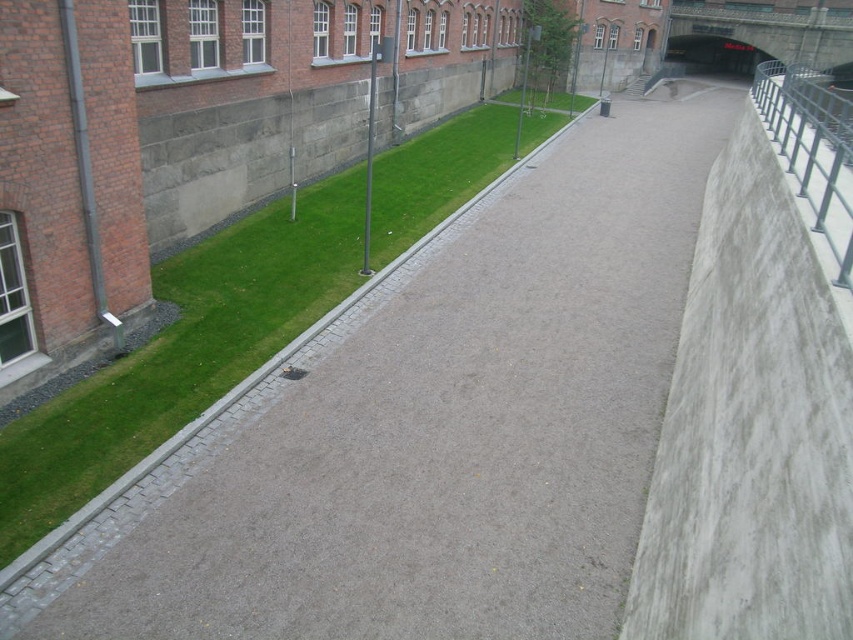
Question: Is green grass at center positioned before metallic gray bench at lower center?

Choices:
 (A) no
 (B) yes

Answer: (B)

Question: Which of the following is the closest to the observer?

Choices:
 (A) (303, 371)
 (B) (50, 525)

Answer: (B)

Question: Observing the image, what is the correct spatial positioning of green grass at center in reference to metallic gray bench at lower center?

Choices:
 (A) right
 (B) left

Answer: (B)

Question: From the image, what is the correct spatial relationship of green grass at center in relation to metallic gray bench at lower center?

Choices:
 (A) below
 (B) above

Answer: (B)

Question: Which point appears farthest from the camera in this image?

Choices:
 (A) (392, 150)
 (B) (299, 369)

Answer: (A)